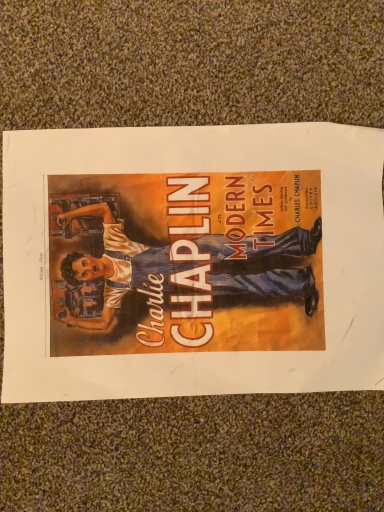
Where is `free space above matte paper poster at center (from a real-world perspective)`? This screenshot has width=384, height=512. free space above matte paper poster at center (from a real-world perspective) is located at coordinates (186, 267).